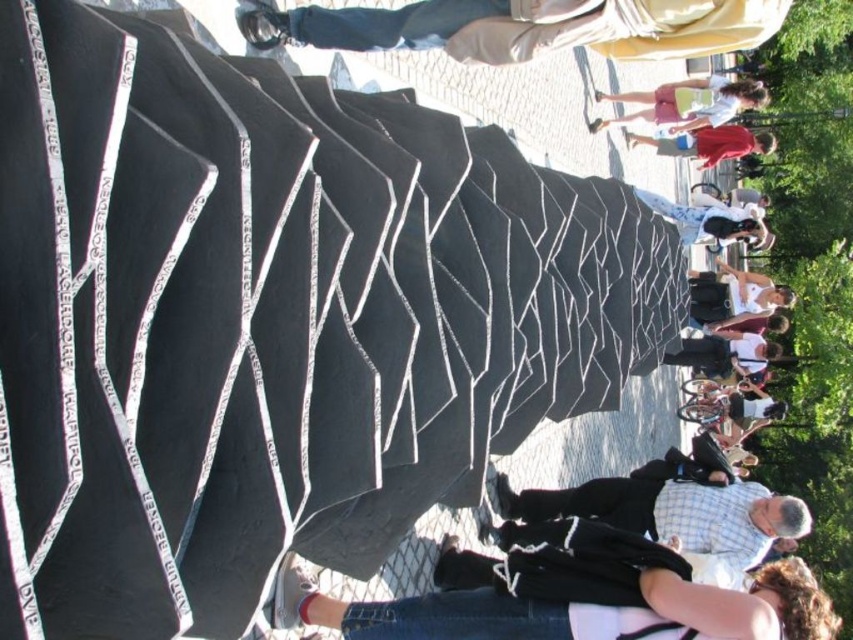
Question: Where is light pink shorts at upper right located in relation to matte black dress at center in the image?

Choices:
 (A) left
 (B) right

Answer: (A)

Question: Estimate the real-world distances between objects in this image. Which object is farther from the light pink shorts at upper right?

Choices:
 (A) light beige fabric at upper center
 (B) matte black dress at center
 (C) checkered shirt at center

Answer: (A)

Question: Can you confirm if checkered shirt at center is wider than matte black dress at center?

Choices:
 (A) no
 (B) yes

Answer: (A)

Question: Which object is positioned closest to the light beige fabric at upper center?

Choices:
 (A) checkered shirt at center
 (B) matte black dress at center

Answer: (A)

Question: Can you confirm if light beige fabric at upper center is thinner than matte black dress at center?

Choices:
 (A) yes
 (B) no

Answer: (A)

Question: Which point appears closest to the camera in this image?

Choices:
 (A) (624, 515)
 (B) (677, 99)
 (C) (532, 45)
 (D) (724, 129)

Answer: (C)